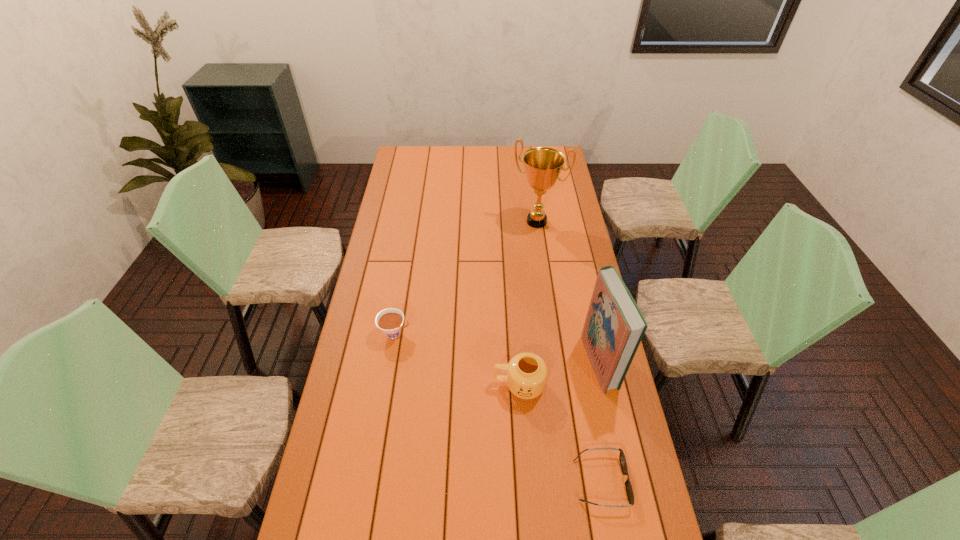
Identify the location of the fourth closest object to the award. (629, 490).

The image size is (960, 540). What are the coordinates of `vacant point that satisfies the following two spatial constraints: 1. on the front side of the farthest object; 2. on the front-facing side of the shortest object` in the screenshot? It's located at (573, 481).